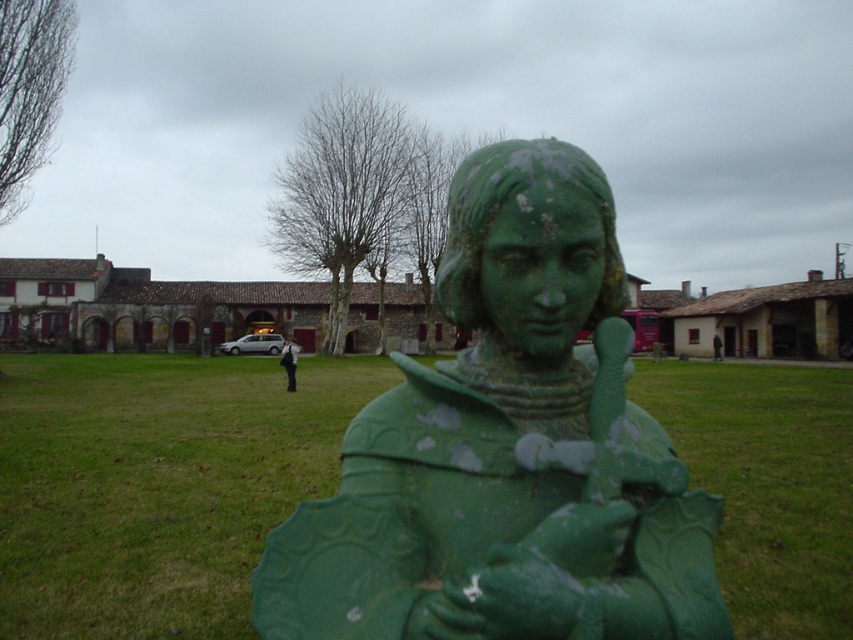
Question: Can you confirm if green patinated metal statue at center is bigger than green painted metal statue at center?

Choices:
 (A) yes
 (B) no

Answer: (B)

Question: Is green patinated metal statue at center thinner than green painted metal statue at center?

Choices:
 (A) no
 (B) yes

Answer: (B)

Question: Among these points, which one is farthest from the camera?

Choices:
 (A) (283, 358)
 (B) (682, 604)

Answer: (A)

Question: Which point appears closest to the camera in this image?

Choices:
 (A) (664, 444)
 (B) (227, 442)
 (C) (292, 390)

Answer: (A)

Question: Is green patinated metal statue at center to the left of green painted metal statue at center from the viewer's perspective?

Choices:
 (A) yes
 (B) no

Answer: (A)

Question: Which point appears farthest from the camera in this image?

Choices:
 (A) (281, 362)
 (B) (553, 627)

Answer: (A)